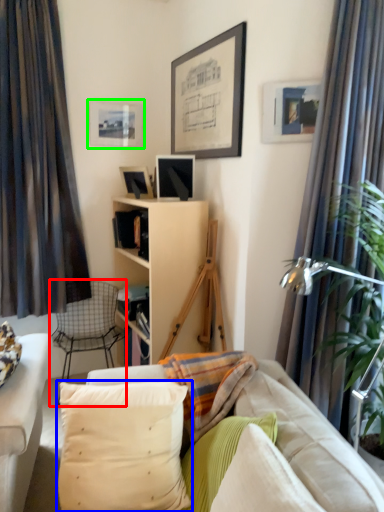
Question: Considering the real-world distances, which object is farthest from chair (highlighted by a red box)? pillow (highlighted by a blue box) or picture frame (highlighted by a green box)?

Choices:
 (A) pillow
 (B) picture frame

Answer: (A)